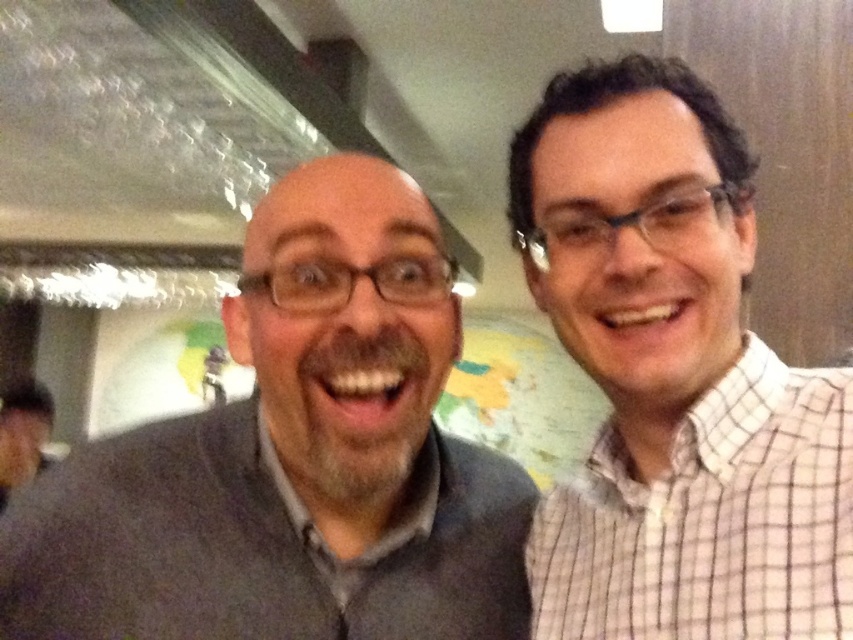
Question: Is gray sweater at left closer to the viewer compared to white checkered shirt at right?

Choices:
 (A) yes
 (B) no

Answer: (B)

Question: Does gray sweater at left appear on the right side of white checkered shirt at right?

Choices:
 (A) yes
 (B) no

Answer: (B)

Question: Is gray sweater at left smaller than white checkered shirt at right?

Choices:
 (A) yes
 (B) no

Answer: (B)

Question: Among these points, which one is nearest to the camera?

Choices:
 (A) (566, 502)
 (B) (302, 429)

Answer: (B)